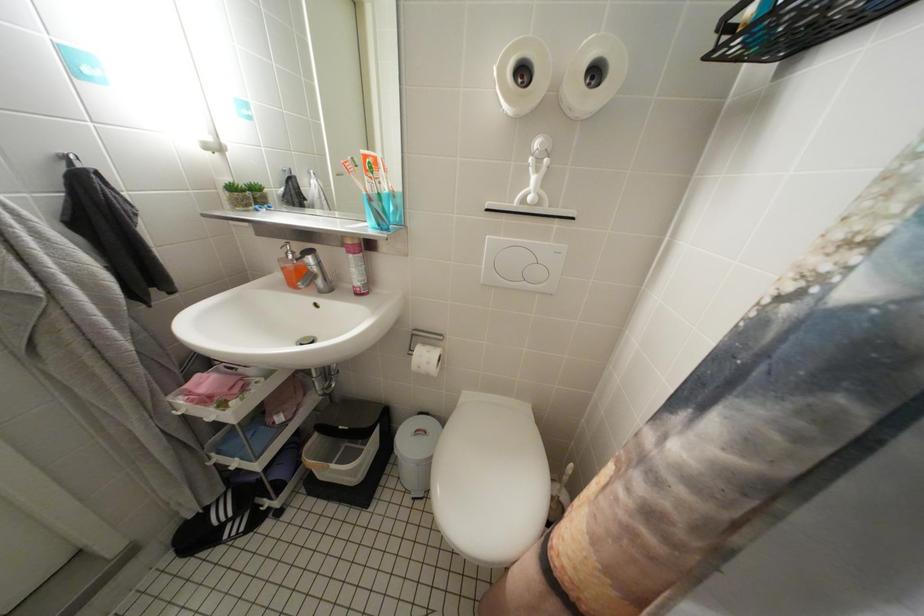
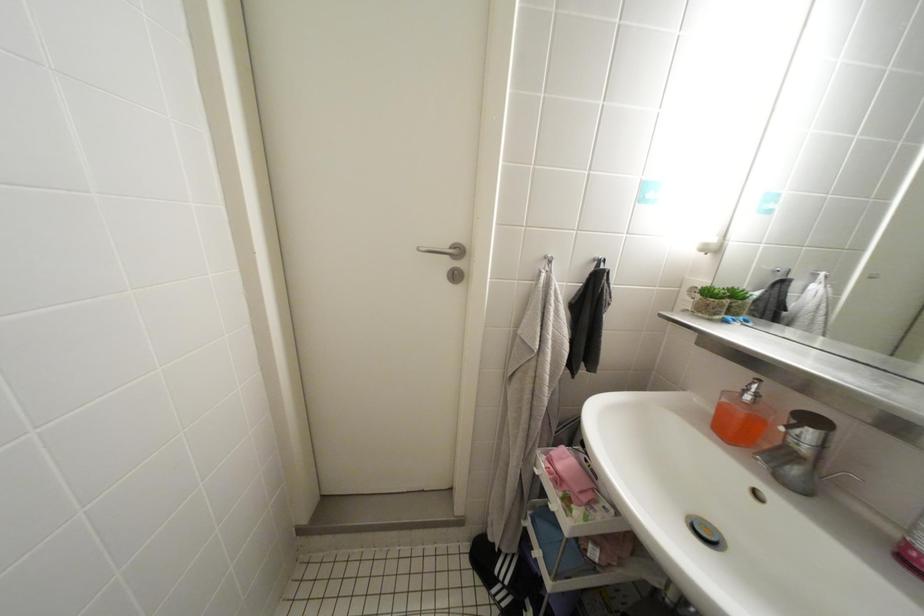
Question: Based on the continuous images, in which direction is the camera rotating? Reply with the corresponding letter.

Choices:
 (A) Left
 (B) Right
 (C) Up
 (D) Down

Answer: (A)